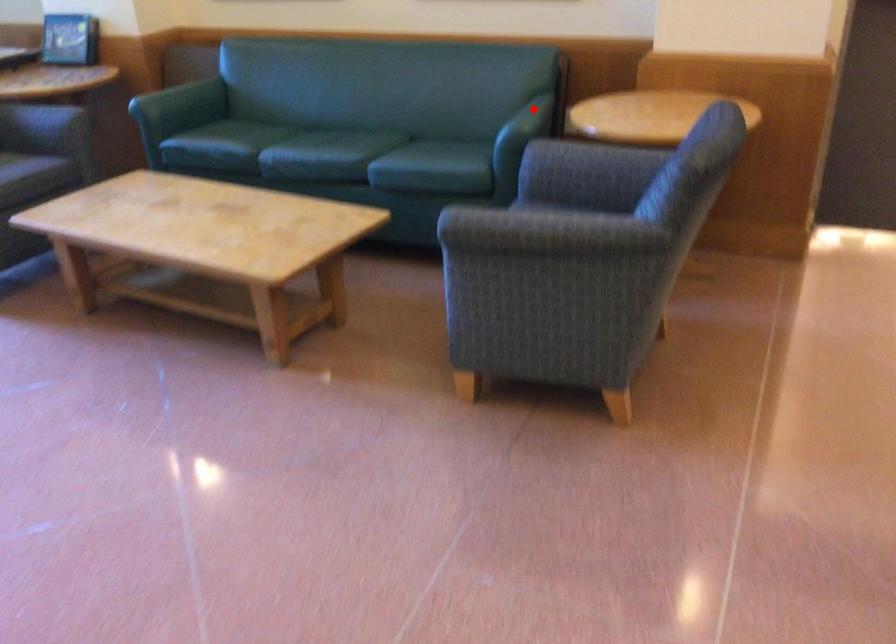
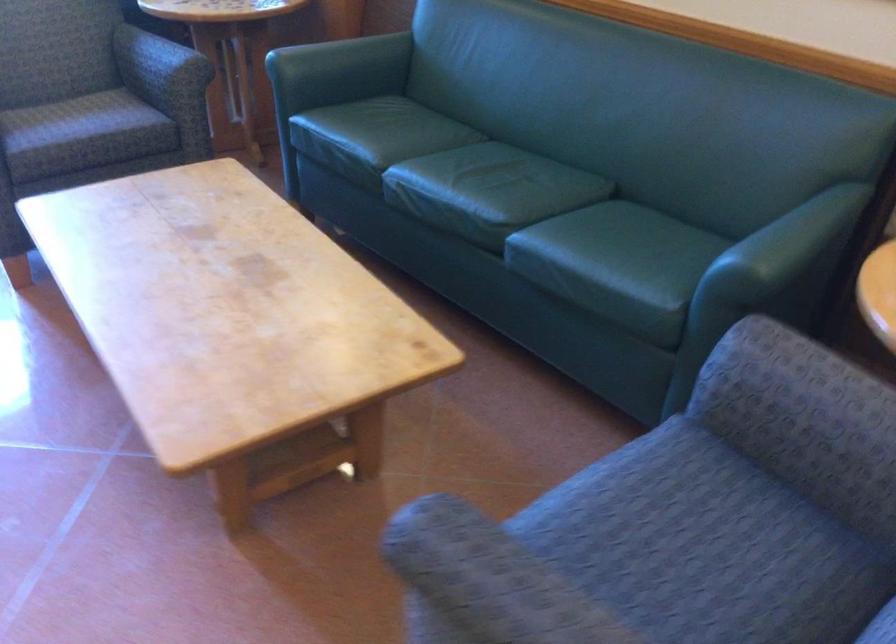
Question: I am providing you with two images of the same scene from different viewpoints. In image1, a red point is highlighted. Considering the same 3D point in image2, which of the following is correct?

Choices:
 (A) It is closer
 (B) It is farther

Answer: (A)